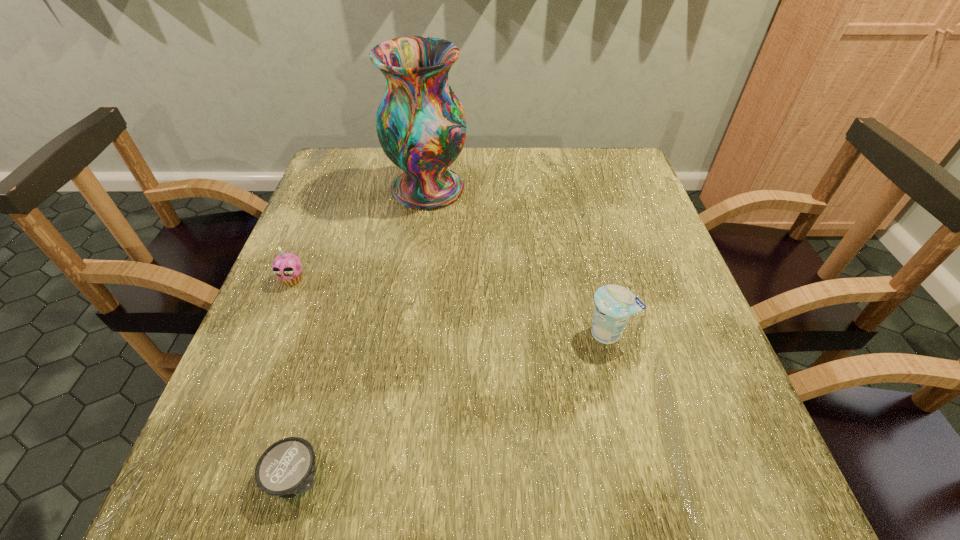
This screenshot has height=540, width=960. I want to click on vacant area that lies between the nearest object and the tallest object, so click(362, 333).

Locate an element on the screen. vacant space that is in between the cupcake and the farther yogurt is located at coordinates (450, 306).

This screenshot has width=960, height=540. I want to click on vacant space in between the leftmost object and the nearer yogurt, so click(295, 379).

Find the location of `object that is the third closest to the third nearest object`. object that is the third closest to the third nearest object is located at coordinates (614, 304).

Select which object is the second closest to the shortest object. Please provide its 2D coordinates. Your answer should be formatted as a tuple, i.e. [(x, y)], where the tuple contains the x and y coordinates of a point satisfying the conditions above.

[(614, 304)]

Locate an element on the screen. The height and width of the screenshot is (540, 960). vacant area in the image that satisfies the following two spatial constraints: 1. on the face of the cupcake; 2. on the right side of the shortest object is located at coordinates (212, 477).

This screenshot has width=960, height=540. Identify the location of vacant space that satisfies the following two spatial constraints: 1. on the face of the shortest object; 2. on the left side of the cupcake. (212, 477).

Identify the location of free spot that satisfies the following two spatial constraints: 1. on the face of the shortest object; 2. on the right side of the leftmost object. This screenshot has height=540, width=960. (212, 477).

At what (x,y) coordinates should I click in order to perform the action: click on vacant region that satisfies the following two spatial constraints: 1. on the face of the left yogurt; 2. on the left side of the cupcake. Please return your answer as a coordinate pair (x, y). Looking at the image, I should click on (212, 477).

At what (x,y) coordinates should I click in order to perform the action: click on vacant space that satisfies the following two spatial constraints: 1. on the face of the nearer yogurt; 2. on the left side of the cupcake. Please return your answer as a coordinate pair (x, y). Looking at the image, I should click on (212, 477).